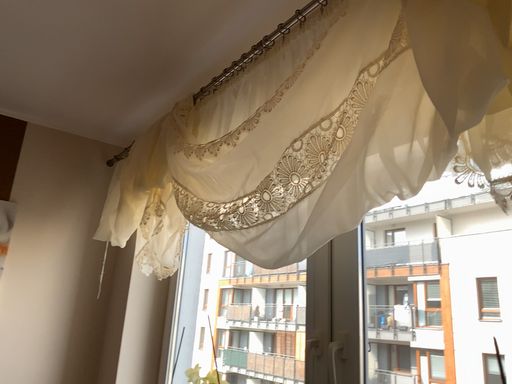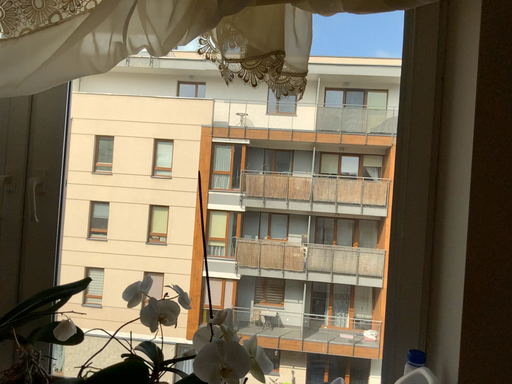
Question: Which way did the camera rotate in the video?

Choices:
 (A) rotated right
 (B) rotated left

Answer: (A)